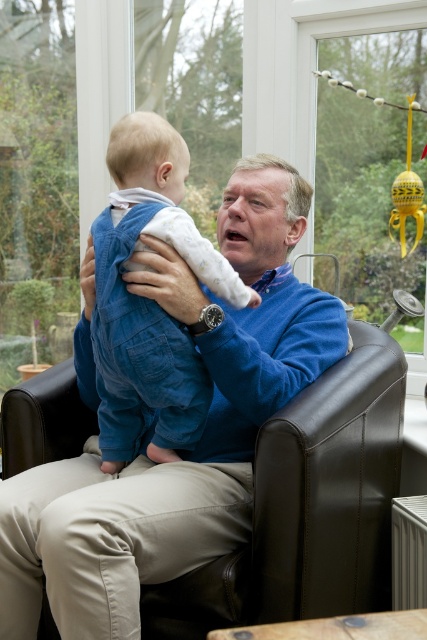
Question: Can you confirm if blue sweater at center is positioned to the left of denim overalls at center?

Choices:
 (A) yes
 (B) no

Answer: (B)

Question: Does blue sweater at center appear on the right side of denim overalls at center?

Choices:
 (A) yes
 (B) no

Answer: (A)

Question: Among these points, which one is farthest from the camera?

Choices:
 (A) (137, 397)
 (B) (158, 483)

Answer: (A)

Question: Can you confirm if blue sweater at center is smaller than denim overalls at center?

Choices:
 (A) no
 (B) yes

Answer: (A)